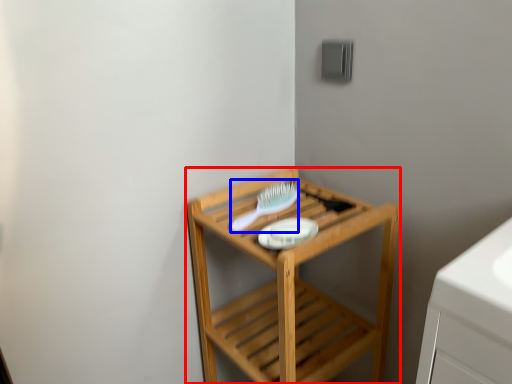
Question: Among these objects, which one is farthest to the camera, furniture (highlighted by a red box) or brush (highlighted by a blue box)?

Choices:
 (A) furniture
 (B) brush

Answer: (B)